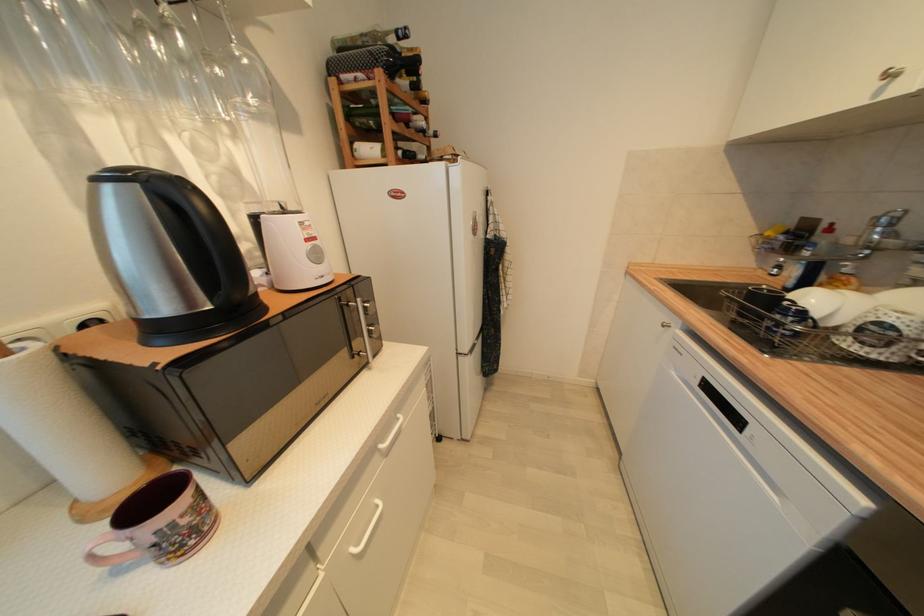
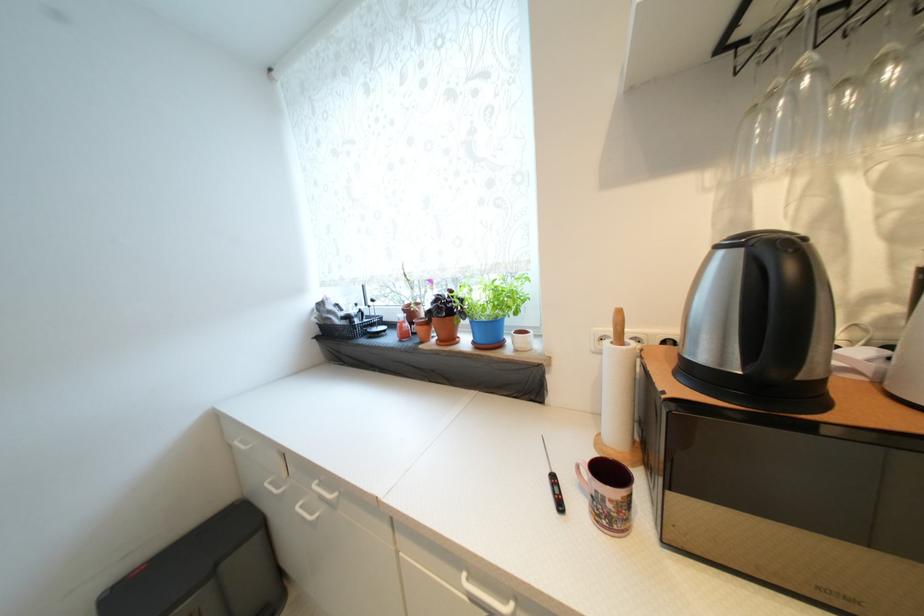
In the second image, find the point that corresponds to point 124,573 in the first image.

(586, 488)